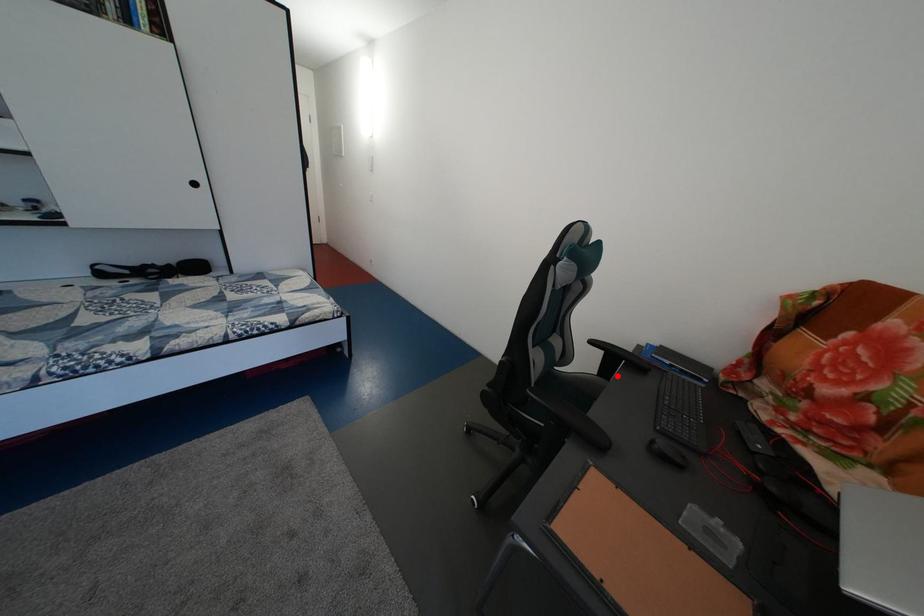
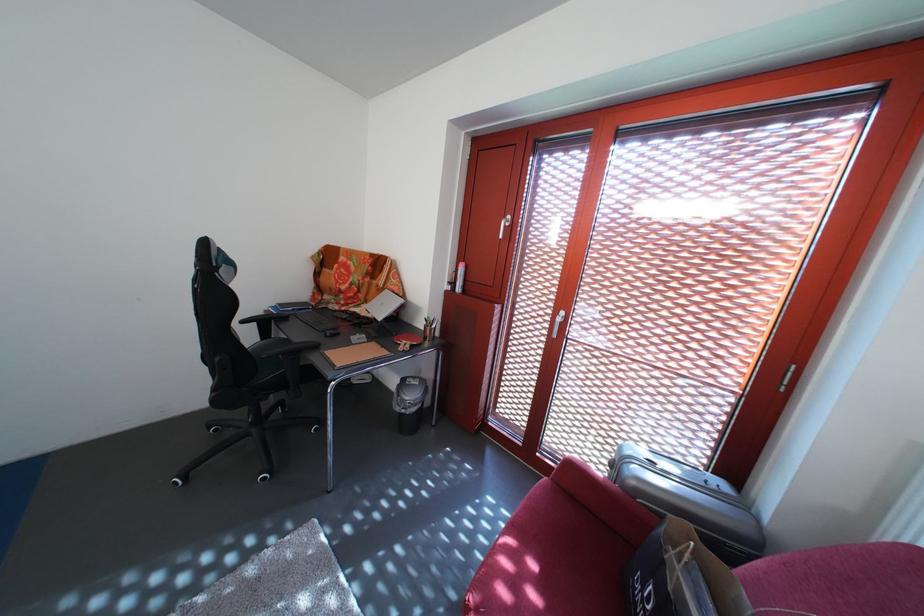
Locate, in the second image, the point that corresponds to the highlighted location in the first image.

(275, 339)